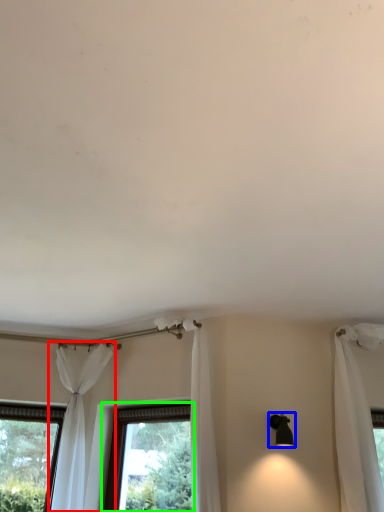
Question: Which object is the closest to the curtain (highlighted by a red box)? Choose among these: light fixture (highlighted by a blue box) or window (highlighted by a green box).

Choices:
 (A) light fixture
 (B) window

Answer: (B)